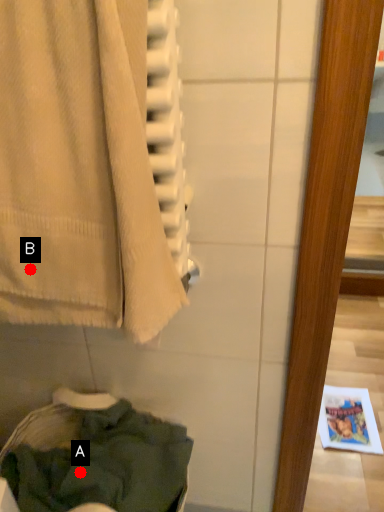
Question: Two points are circled on the image, labeled by A and B beside each circle. Which point is farther to the camera?

Choices:
 (A) A is further
 (B) B is further

Answer: (A)